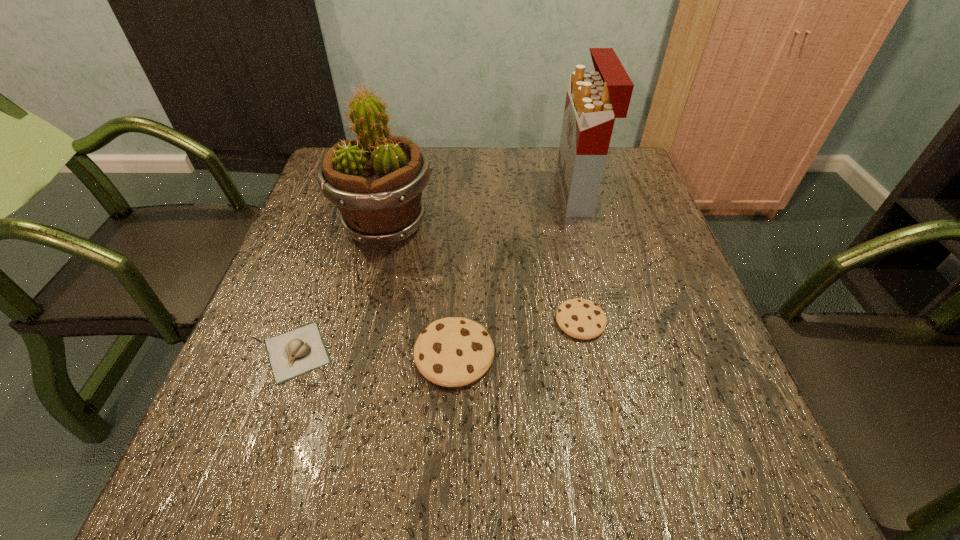
Image resolution: width=960 pixels, height=540 pixels. Identify the location of vacant area situated 0.100m on the right of the shortest object. (388, 352).

At what (x,y) coordinates should I click in order to perform the action: click on vacant space located 0.330m with the lid open on the cigarette case. Please return your answer as a coordinate pair (x, y). Looking at the image, I should click on (438, 193).

Where is `free space located with the lid open on the cigarette case`? free space located with the lid open on the cigarette case is located at coordinates (497, 193).

Where is `free region located with the lid open on the cigarette case`? Image resolution: width=960 pixels, height=540 pixels. free region located with the lid open on the cigarette case is located at coordinates (513, 193).

Image resolution: width=960 pixels, height=540 pixels. Find the location of `object present at the far edge`. object present at the far edge is located at coordinates (594, 99).

I want to click on object present at the near edge, so pyautogui.click(x=452, y=352).

Where is `flowerpot that is at the left edge`? This screenshot has width=960, height=540. flowerpot that is at the left edge is located at coordinates (376, 180).

This screenshot has height=540, width=960. What are the coordinates of `garlic that is at the left edge` in the screenshot? It's located at (296, 352).

Locate an element on the screen. This screenshot has width=960, height=540. object that is at the right edge is located at coordinates (594, 99).

Image resolution: width=960 pixels, height=540 pixels. In order to click on object that is positioned at the far right corner in this screenshot , I will do `click(594, 99)`.